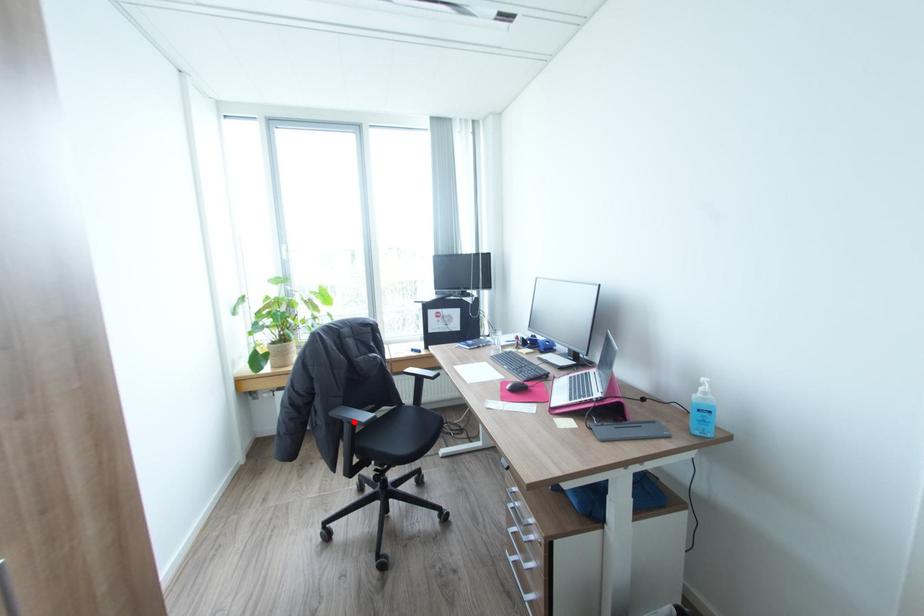
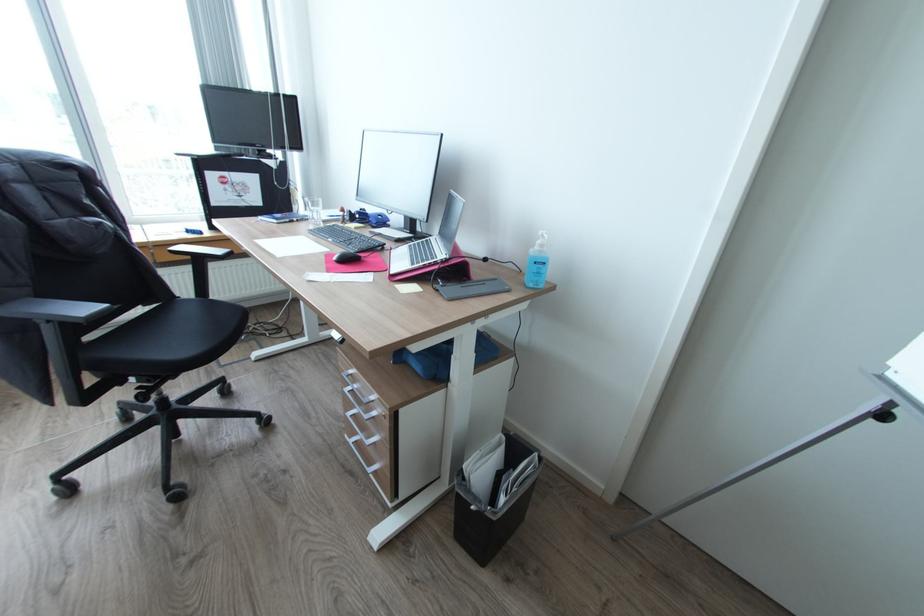
The point at the highlighted location is marked in the first image. Where is the corresponding point in the second image?

(55, 321)